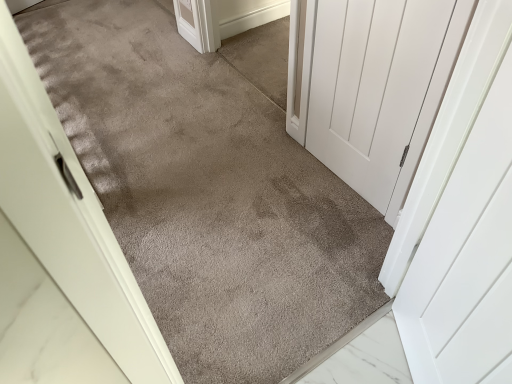
Question: Should I look upward or downward to see white matte door at center?

Choices:
 (A) down
 (B) up

Answer: (B)